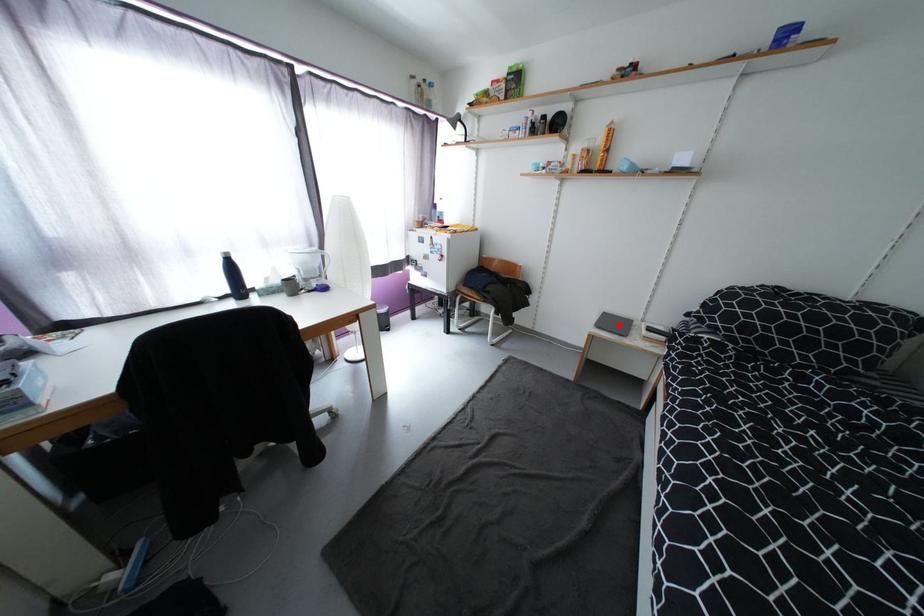
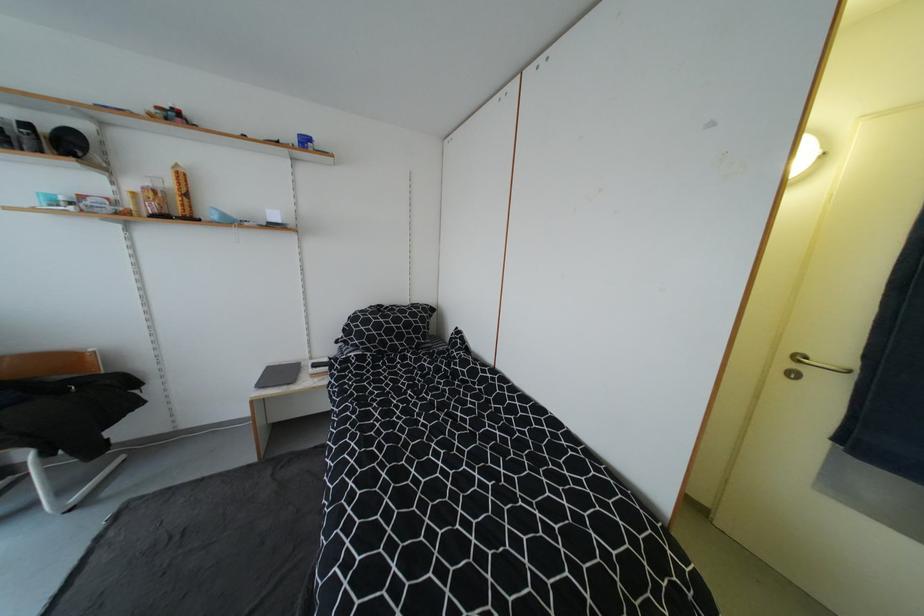
Question: I am providing you with two images of the same scene from different viewpoints. Image1 has a red point marked. In image2, the corresponding 3D location appears at what relative position? Reply with the corresponding letter.

Choices:
 (A) Closer
 (B) Farther

Answer: (B)